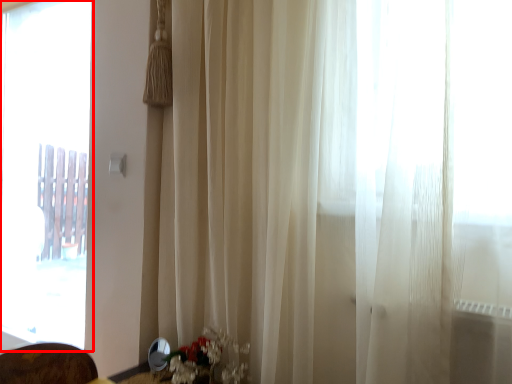
Question: Observing the image, what is the correct spatial positioning of window (annotated by the red box) in reference to floral arrangement?

Choices:
 (A) right
 (B) left

Answer: (B)